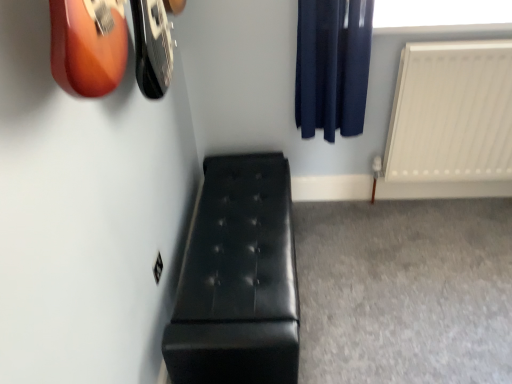
The image size is (512, 384). Identify the location of white matte radiator at right. (450, 122).

This screenshot has height=384, width=512. What do you see at coordinates (238, 279) in the screenshot?
I see `black leather bench at lower left` at bounding box center [238, 279].

Describe the element at coordinates (332, 66) in the screenshot. I see `dark blue fabric curtain at upper right` at that location.

Locate an element on the screen. The width and height of the screenshot is (512, 384). white matte radiator at right is located at coordinates (450, 122).

Can you tell me how much black leather bench at lower left and dark blue fabric curtain at upper right differ in facing direction?

The facing directions of black leather bench at lower left and dark blue fabric curtain at upper right are 89.8 degrees apart.

Does black leather bench at lower left appear on the right side of dark blue fabric curtain at upper right?

No.

At what (x,y) coordinates should I click in order to perform the action: click on furniture that appears in front of the dark blue fabric curtain at upper right. Please return your answer as a coordinate pair (x, y). The height and width of the screenshot is (384, 512). Looking at the image, I should click on (238, 279).

In terms of size, does black leather bench at lower left appear bigger or smaller than dark blue fabric curtain at upper right?

Considering their sizes, black leather bench at lower left takes up more space than dark blue fabric curtain at upper right.

Are dark blue fabric curtain at upper right and black leather bench at lower left beside each other?

No, dark blue fabric curtain at upper right is not in contact with black leather bench at lower left.

In order to click on furniture in front of the dark blue fabric curtain at upper right in this screenshot , I will do `click(238, 279)`.

Between dark blue fabric curtain at upper right and black leather bench at lower left, which one has less height?

With less height is black leather bench at lower left.

From a real-world perspective, is dark blue fabric curtain at upper right on top of black leather bench at lower left?

Yes, from a real-world perspective, dark blue fabric curtain at upper right is above black leather bench at lower left.

From a real-world perspective, which is physically above, white matte radiator at right or dark blue fabric curtain at upper right?

dark blue fabric curtain at upper right is physically above.

Which of these two, white matte radiator at right or dark blue fabric curtain at upper right, is bigger?

Bigger between the two is white matte radiator at right.

Is white matte radiator at right looking in the opposite direction of dark blue fabric curtain at upper right?

No, white matte radiator at right is not facing away from dark blue fabric curtain at upper right.

Does white matte radiator at right have a greater height compared to dark blue fabric curtain at upper right?

Correct, white matte radiator at right is much taller as dark blue fabric curtain at upper right.

From a real-world perspective, is dark blue fabric curtain at upper right on transparent plastic window screen at upper right?

Actually, dark blue fabric curtain at upper right is physically below transparent plastic window screen at upper right in the real world.

Who is shorter, dark blue fabric curtain at upper right or transparent plastic window screen at upper right?

transparent plastic window screen at upper right is shorter.

Considering the relative positions of dark blue fabric curtain at upper right and transparent plastic window screen at upper right in the image provided, is dark blue fabric curtain at upper right to the left of transparent plastic window screen at upper right from the viewer's perspective?

Yes, dark blue fabric curtain at upper right is to the left of transparent plastic window screen at upper right.

In the image, is white matte radiator at right on the left side or the right side of black leather bench at lower left?

In the image, white matte radiator at right appears on the right side of black leather bench at lower left.

Identify the location of radiator that appears above the black leather bench at lower left (from the image's perspective). Image resolution: width=512 pixels, height=384 pixels. coord(450,122).

Which object is wider, white matte radiator at right or black leather bench at lower left?

Wider between the two is black leather bench at lower left.

Considering the positions of points (502, 80) and (191, 260), is point (502, 80) closer to camera compared to point (191, 260)?

No, it is behind (191, 260).

Considering the sizes of objects black leather bench at lower left and transparent plastic window screen at upper right in the image provided, who is smaller, black leather bench at lower left or transparent plastic window screen at upper right?

transparent plastic window screen at upper right is smaller.

Does black leather bench at lower left contain transparent plastic window screen at upper right?

No, transparent plastic window screen at upper right is not a part of black leather bench at lower left.

Considering the sizes of objects black leather bench at lower left and transparent plastic window screen at upper right in the image provided, who is taller, black leather bench at lower left or transparent plastic window screen at upper right?

black leather bench at lower left is taller.

Is black leather bench at lower left aimed at transparent plastic window screen at upper right?

No, black leather bench at lower left is not aimed at transparent plastic window screen at upper right.

Relative to white matte radiator at right, is transparent plastic window screen at upper right in front or behind?

transparent plastic window screen at upper right is positioned farther from the viewer than white matte radiator at right.

Is transparent plastic window screen at upper right positioned with its back to white matte radiator at right?

No, white matte radiator at right is not at the back of transparent plastic window screen at upper right.

Find the location of a particular element. The width and height of the screenshot is (512, 384). window screen that appears on the left of white matte radiator at right is located at coordinates (441, 13).

Find the location of `curtain lying on the right of black leather bench at lower left`. curtain lying on the right of black leather bench at lower left is located at coordinates (332, 66).

The height and width of the screenshot is (384, 512). Identify the location of curtain lying behind the black leather bench at lower left. coord(332,66).

From the image, which object appears to be nearer to dark blue fabric curtain at upper right, black leather bench at lower left or white matte radiator at right?

white matte radiator at right is positioned closer to the anchor dark blue fabric curtain at upper right.

Estimate the real-world distances between objects in this image. Which object is closer to dark blue fabric curtain at upper right, transparent plastic window screen at upper right or white matte radiator at right?

The object closer to dark blue fabric curtain at upper right is transparent plastic window screen at upper right.

Based on their spatial positions, is white matte radiator at right or black leather bench at lower left further from dark blue fabric curtain at upper right?

The object further to dark blue fabric curtain at upper right is black leather bench at lower left.

Which object lies nearer to the anchor point black leather bench at lower left, white matte radiator at right or transparent plastic window screen at upper right?

white matte radiator at right is positioned closer to the anchor black leather bench at lower left.

Estimate the real-world distances between objects in this image. Which object is further from black leather bench at lower left, white matte radiator at right or dark blue fabric curtain at upper right?

white matte radiator at right lies further to black leather bench at lower left than the other object.

From the image, which object appears to be farther from black leather bench at lower left, transparent plastic window screen at upper right or white matte radiator at right?

Among the two, transparent plastic window screen at upper right is located further to black leather bench at lower left.

Looking at this image, considering their positions, is transparent plastic window screen at upper right positioned further to black leather bench at lower left than dark blue fabric curtain at upper right?

Based on the image, transparent plastic window screen at upper right appears to be further to black leather bench at lower left.

Looking at the image, which one is located further to dark blue fabric curtain at upper right, black leather bench at lower left or transparent plastic window screen at upper right?

The object further to dark blue fabric curtain at upper right is black leather bench at lower left.

This screenshot has width=512, height=384. Identify the location of window screen situated between black leather bench at lower left and white matte radiator at right from left to right. (441, 13).

The height and width of the screenshot is (384, 512). I want to click on curtain between transparent plastic window screen at upper right and black leather bench at lower left in the up-down direction, so click(x=332, y=66).

You are a GUI agent. You are given a task and a screenshot of the screen. Output one action in this format:
    pyautogui.click(x=<x>, y=<y>)
    Task: Click on the window screen located between dark blue fabric curtain at upper right and white matte radiator at right in the left-right direction
    
    Given the screenshot: What is the action you would take?
    pyautogui.click(x=441, y=13)

Locate an element on the screen. curtain situated between black leather bench at lower left and white matte radiator at right from left to right is located at coordinates (332, 66).